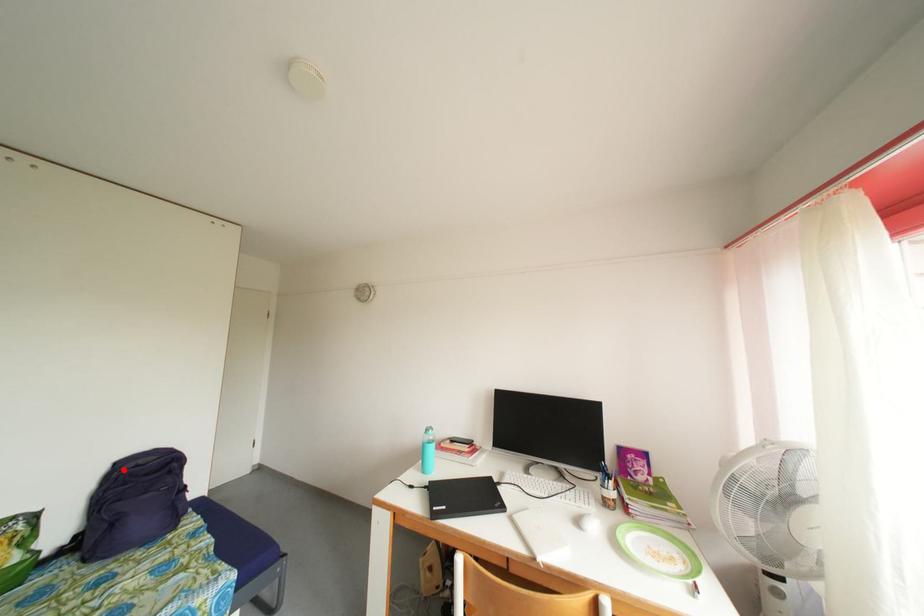
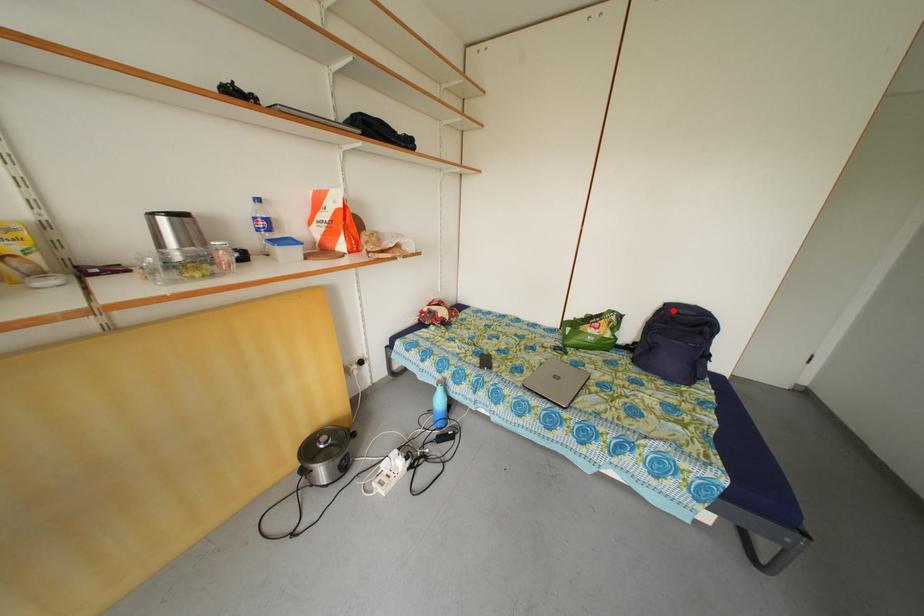
I am providing you with two images of the same scene from different viewpoints. A red point is marked on the first image and another point is marked on the second image. Do the highlighted points in image1 and image2 indicate the same real-world spot?

Yes